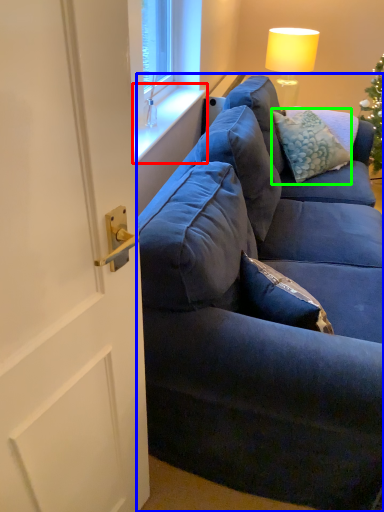
Question: Estimate the real-world distances between objects in this image. Which object is closer to window sill (highlighted by a red box), studio couch (highlighted by a blue box) or pillow (highlighted by a green box)?

Choices:
 (A) studio couch
 (B) pillow

Answer: (B)